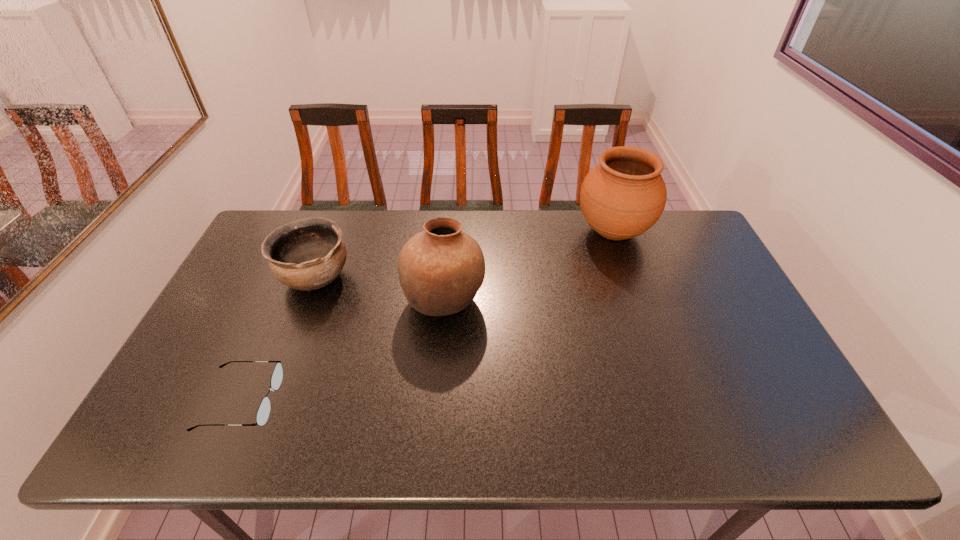
Where is `vacant point that satisfies the following two spatial constraints: 1. on the front side of the second object from right to left; 2. on the lenses of the spectacles`? This screenshot has width=960, height=540. vacant point that satisfies the following two spatial constraints: 1. on the front side of the second object from right to left; 2. on the lenses of the spectacles is located at coordinates click(436, 401).

Locate an element on the screen. This screenshot has width=960, height=540. vacant region that satisfies the following two spatial constraints: 1. on the back side of the rightmost object; 2. on the left side of the shortest pottery is located at coordinates (333, 232).